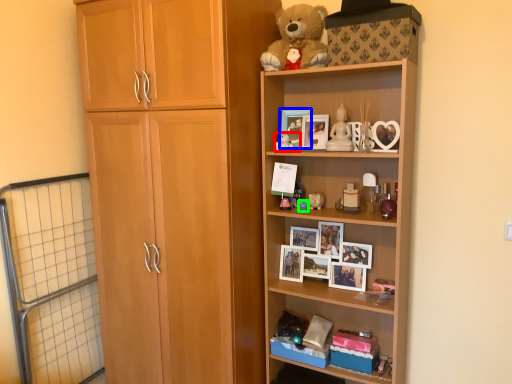
Question: Estimate the real-world distances between objects in this image. Which object is farther from toy (highlighted by a red box), picture frame (highlighted by a blue box) or toy (highlighted by a green box)?

Choices:
 (A) picture frame
 (B) toy

Answer: (B)